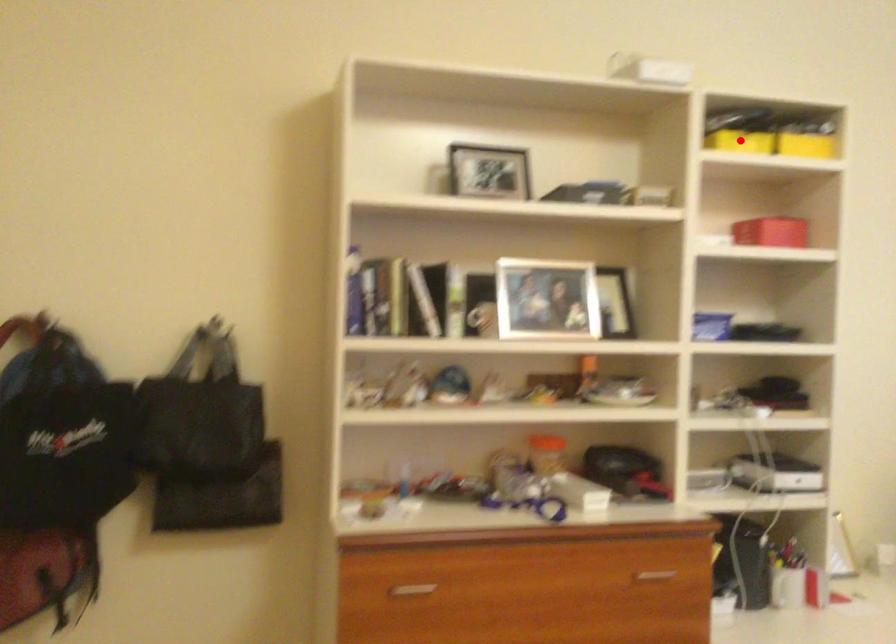
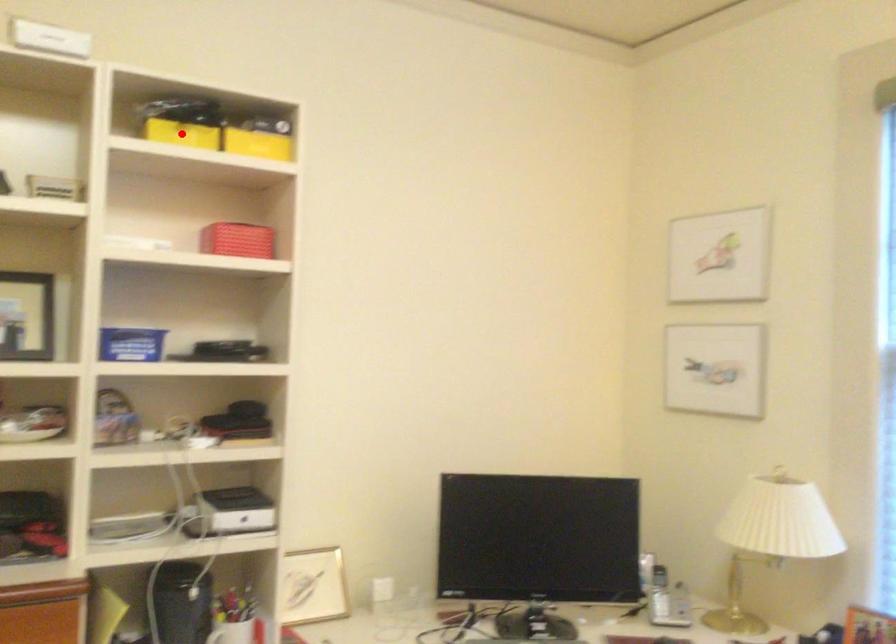
I am providing you with two images of the same scene from different viewpoints. A red point is marked on the first image and another point is marked on the second image. Does the point marked in image1 correspond to the same location as the one in image2?

Yes